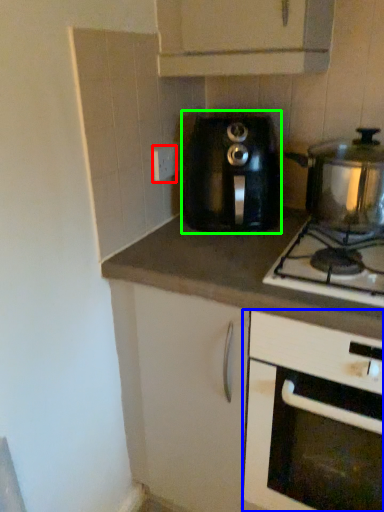
Question: Estimate the real-world distances between objects in this image. Which object is farther from electric outlet (highlighted by a red box), cabinetry (highlighted by a blue box) or kitchen appliance (highlighted by a green box)?

Choices:
 (A) cabinetry
 (B) kitchen appliance

Answer: (A)